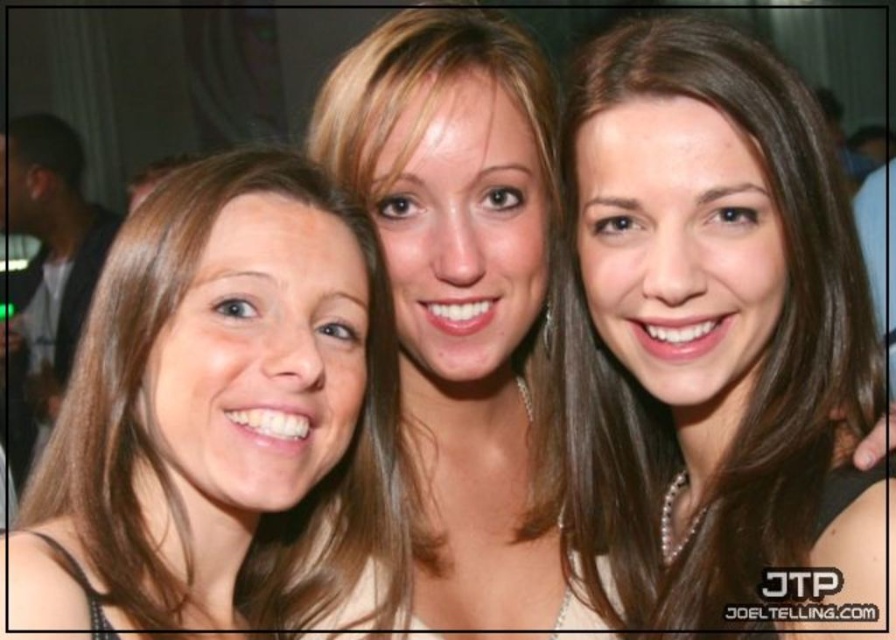
You are a photographer trying to adjust the focus of your camera. You notice the brown hair at center and the smooth skin face at center in your viewfinder. Given their distance apart, can you focus on both subjects simultaneously without any adjustments?

The brown hair at center is 4.40 meters from the smooth skin face at center. Since the distance between them is significant, adjusting the focus might be necessary to ensure both are in clear view.

You are a photographer trying to adjust the lighting for the three women in the photo. Since the brown hair at center and the blonde hair at center are both in the frame, which one might require more careful lighting adjustments to avoid overexposure?

The brown hair at center is larger in size than the blonde hair at center, so it might require more careful lighting adjustments to avoid overexposure.